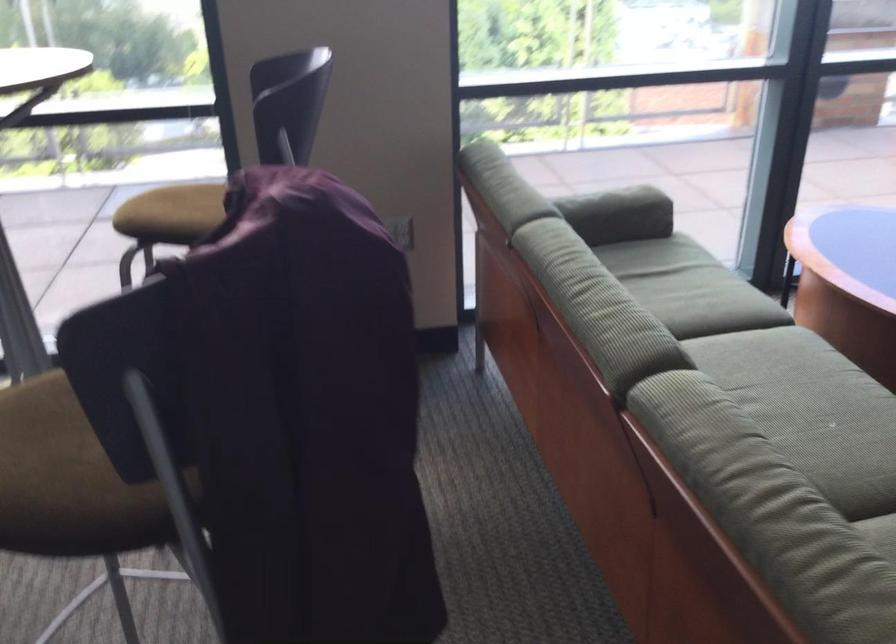
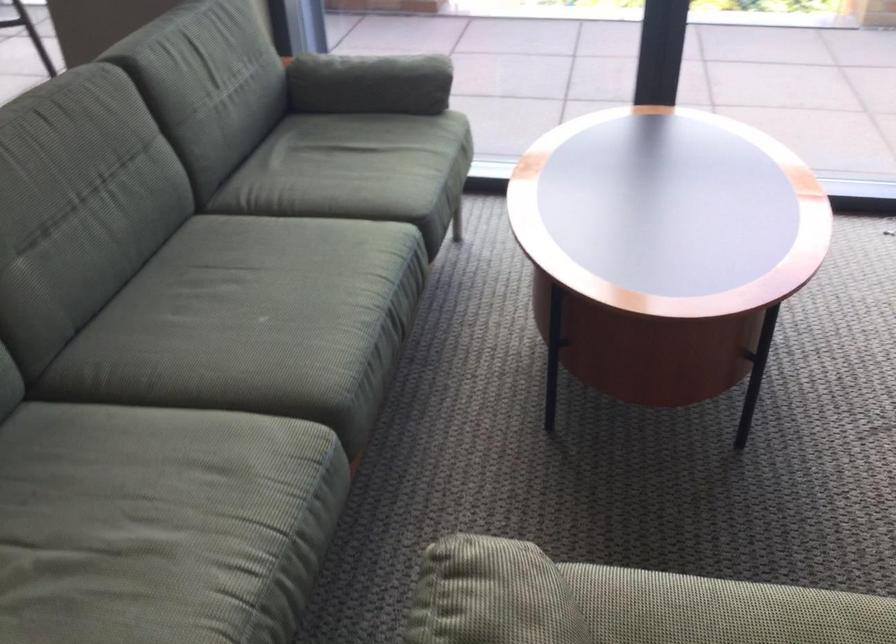
Question: Which direction would the cameraman need to move to produce the second image? Reply with the corresponding letter.

Choices:
 (A) Left
 (B) Right
 (C) Forward
 (D) Backward

Answer: (B)